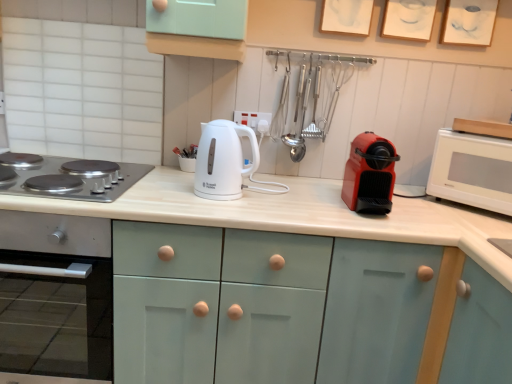
You are a GUI agent. You are given a task and a screenshot of the screen. Output one action in this format:
    pyautogui.click(x=<x>, y=<y>)
    Task: Click on the vacant space in front of red matte coffee machine at right, which is the 2th kitchen appliance from left to right
    
    Given the screenshot: What is the action you would take?
    pyautogui.click(x=376, y=228)